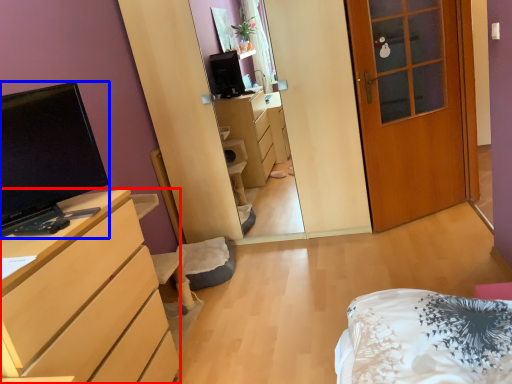
Question: Among these objects, which one is nearest to the camera, cabinetry (highlighted by a red box) or television (highlighted by a blue box)?

Choices:
 (A) cabinetry
 (B) television

Answer: (A)